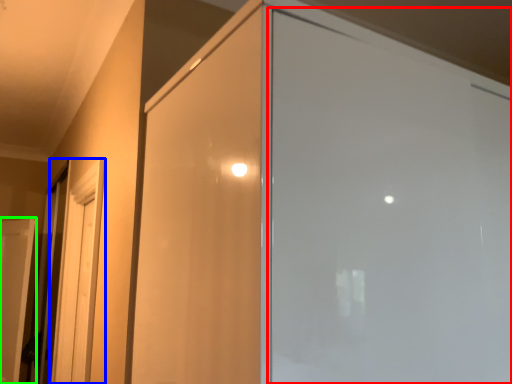
Question: Estimate the real-world distances between objects in this image. Which object is farther from screen door (highlighted by a red box), screen door (highlighted by a blue box) or door (highlighted by a green box)?

Choices:
 (A) screen door
 (B) door

Answer: (B)